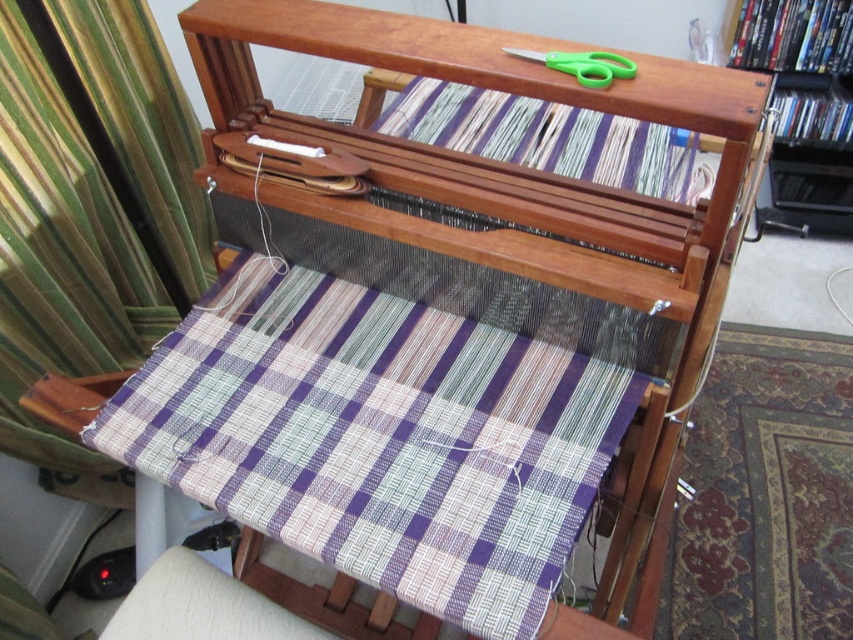
Does wooden bookshelf at upper right have a smaller size compared to green plastic scissors at upper center?

No, wooden bookshelf at upper right is not smaller than green plastic scissors at upper center.

Is wooden bookshelf at upper right to the left of green plastic scissors at upper center from the viewer's perspective?

Incorrect, wooden bookshelf at upper right is not on the left side of green plastic scissors at upper center.

The height and width of the screenshot is (640, 853). What are the coordinates of `wooden bookshelf at upper right` in the screenshot? It's located at (799, 64).

Where is `wooden bookshelf at upper right`? This screenshot has height=640, width=853. wooden bookshelf at upper right is located at coordinates (799, 64).

Between plaid fabric at upper center and wooden bookshelf at upper right, which one has more height?

wooden bookshelf at upper right

Does plaid fabric at upper center have a larger size compared to wooden bookshelf at upper right?

Indeed, plaid fabric at upper center has a larger size compared to wooden bookshelf at upper right.

Is point (701, 186) more distant than point (804, 112)?

No.

What are the coordinates of `plaid fabric at upper center` in the screenshot? It's located at (550, 138).

Is green fabric curtain at left positioned behind plaid fabric at upper center?

No, green fabric curtain at left is in front of plaid fabric at upper center.

Which is behind, point (83, 164) or point (549, 140)?

Point (83, 164)

What are the coordinates of `green fabric curtain at left` in the screenshot? It's located at click(90, 218).